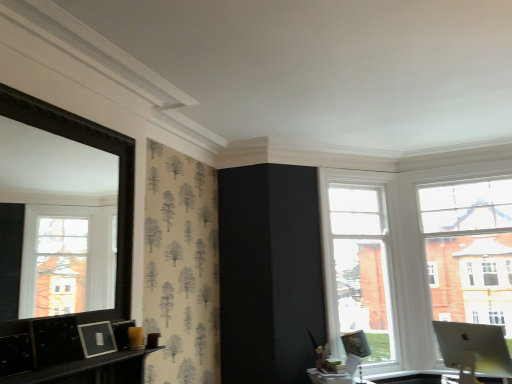
Question: Does silver metallic monitor at lower right have a greater height compared to white glass window at upper right, the 2th window in the left-to-right sequence?

Choices:
 (A) yes
 (B) no

Answer: (B)

Question: Does silver metallic monitor at lower right have a smaller size compared to white glass window at upper right, the 2th window in the left-to-right sequence?

Choices:
 (A) no
 (B) yes

Answer: (B)

Question: From a real-world perspective, is silver metallic monitor at lower right located higher than white glass window at upper right, which ranks as the 1th window in right-to-left order?

Choices:
 (A) no
 (B) yes

Answer: (A)

Question: Is the depth of silver metallic monitor at lower right greater than that of white glass window at upper right, the 2th window in the left-to-right sequence?

Choices:
 (A) no
 (B) yes

Answer: (A)

Question: Does silver metallic monitor at lower right have a larger size compared to white glass window at upper right, which ranks as the 1th window in right-to-left order?

Choices:
 (A) no
 (B) yes

Answer: (A)

Question: Is silver metallic monitor at lower right far from white glass window at upper right, the 2th window in the left-to-right sequence?

Choices:
 (A) yes
 (B) no

Answer: (A)

Question: Is metallic silver swivel chair at right turned away from silver metallic monitor at lower right?

Choices:
 (A) yes
 (B) no

Answer: (B)

Question: Does metallic silver swivel chair at right appear on the right side of silver metallic monitor at lower right?

Choices:
 (A) yes
 (B) no

Answer: (B)

Question: From the image's perspective, is metallic silver swivel chair at right beneath silver metallic monitor at lower right?

Choices:
 (A) yes
 (B) no

Answer: (A)

Question: Is metallic silver swivel chair at right wider than silver metallic monitor at lower right?

Choices:
 (A) no
 (B) yes

Answer: (A)

Question: From the image's perspective, is metallic silver swivel chair at right located above silver metallic monitor at lower right?

Choices:
 (A) yes
 (B) no

Answer: (B)

Question: Is metallic silver swivel chair at right positioned beyond the bounds of silver metallic monitor at lower right?

Choices:
 (A) no
 (B) yes

Answer: (B)

Question: Would you say metallic silver swivel chair at right is outside clear glass window at center, the second window viewed from the right?

Choices:
 (A) no
 (B) yes

Answer: (B)